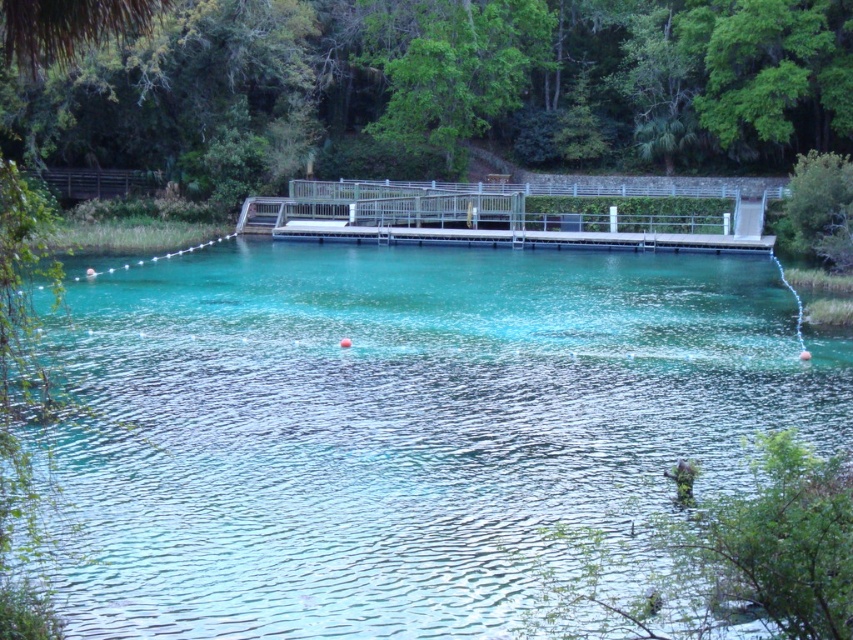
You are standing at the point labeled as point (x=393, y=426) in the image. What can you observe directly beneath your feet?

At point (x=393, y=426) lies clear water at center, so you can observe clear water at center beneath your feet.

Consider the image. You are standing on the metallic gray dock at center and want to reach the clear water at center. In which direction should you move to get to the water?

The clear water at center is positioned on the left side of the metallic gray dock at center, so you should move to the left to reach the water.